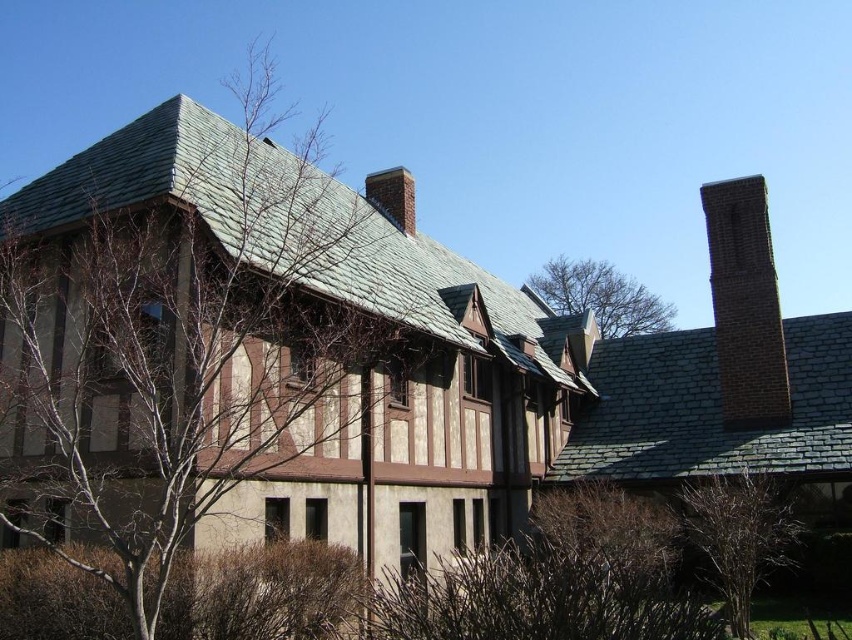
Between brown textured tree at lower right and bare branches at upper center, which one appears on the right side from the viewer's perspective?

From the viewer's perspective, bare branches at upper center appears more on the right side.

Is brown textured tree at lower right smaller than bare branches at upper center?

Yes, brown textured tree at lower right is smaller than bare branches at upper center.

Is point (758, 548) positioned after point (603, 320)?

That is False.

You are a GUI agent. You are given a task and a screenshot of the screen. Output one action in this format:
    pyautogui.click(x=<x>, y=<y>)
    Task: Click on the brown textured tree at lower right
    The image size is (852, 640).
    Given the screenshot: What is the action you would take?
    pyautogui.click(x=740, y=534)

Who is more distant from viewer, [721,212] or [730,598]?

Positioned behind is point [721,212].

Locate an element on the screen. This screenshot has width=852, height=640. brick chimney at upper right is located at coordinates (746, 305).

What do you see at coordinates (183, 340) in the screenshot? The image size is (852, 640). I see `bare branches at left` at bounding box center [183, 340].

Find the location of a particular element. This screenshot has height=640, width=852. bare branches at left is located at coordinates (183, 340).